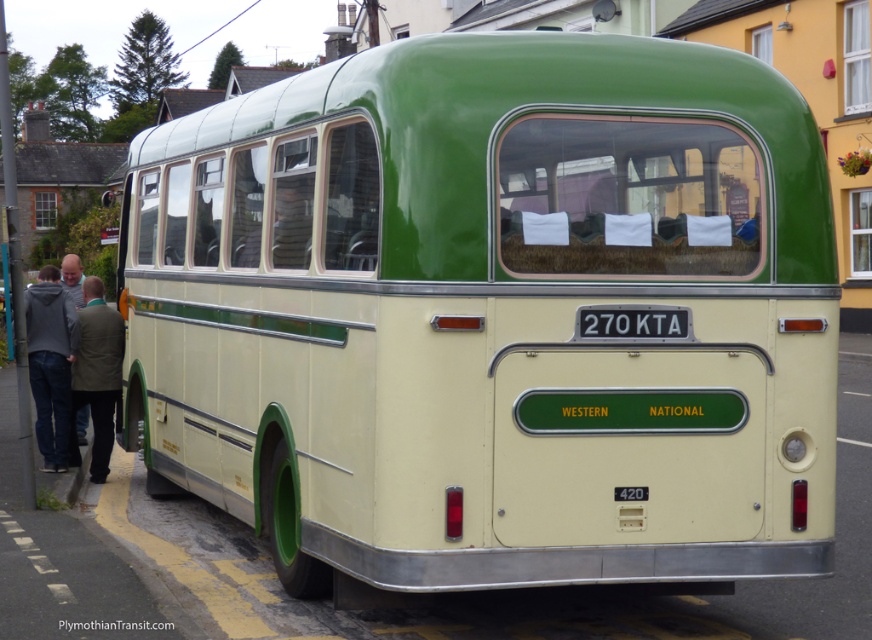
You are a bus inspector checking the rear of a vintage bus. You notice a green fabric jacket at left and a white plastic license plate at center. Which object is bigger in size?

The green fabric jacket at left is larger in size than the white plastic license plate at center according to the description.

You are a pedestrian standing in front of the vintage bus. You notice a gray hoodie at left and a white plastic license plate at center. Which object is positioned to the left of the other?

The gray hoodie at left is to the left of the white plastic license plate at center.

You are standing in front of the vintage bus and notice two points marked on its rear side. Which point, point (45, 422) or point (100, 284), is closer to you?

Point (45, 422) is closer to the viewer than point (100, 284).